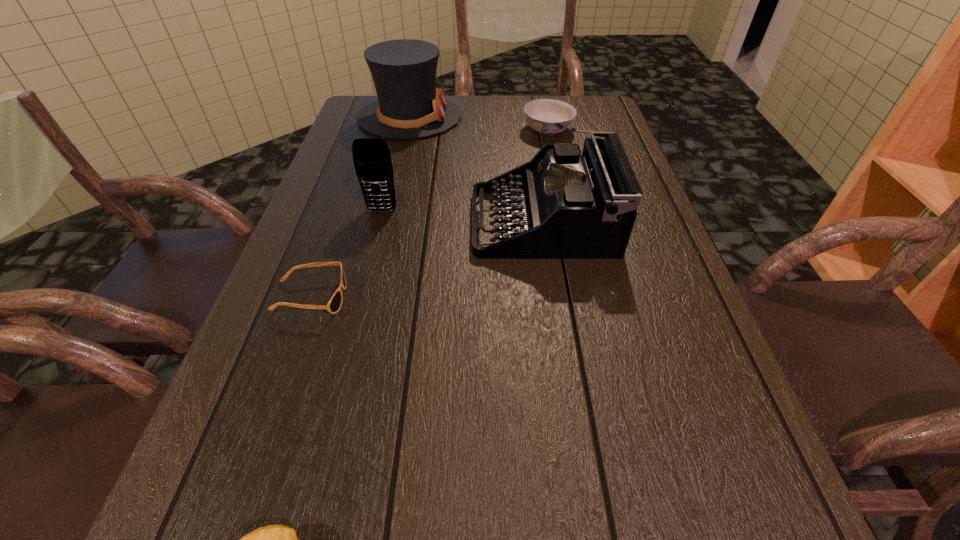
Locate an element on the screen. The height and width of the screenshot is (540, 960). object located in the far left corner section of the desktop is located at coordinates (409, 106).

Image resolution: width=960 pixels, height=540 pixels. Find the location of `object that is at the far right corner`. object that is at the far right corner is located at coordinates (548, 117).

Locate an element on the screen. The width and height of the screenshot is (960, 540). free point at the far edge is located at coordinates 522,117.

Locate an element on the screen. The width and height of the screenshot is (960, 540). blank space at the left edge is located at coordinates (358, 242).

Locate an element on the screen. This screenshot has width=960, height=540. vacant space at the far right corner of the desktop is located at coordinates (580, 124).

Image resolution: width=960 pixels, height=540 pixels. What are the coordinates of `free space between the cellular telephone and the dress hat` in the screenshot? It's located at (396, 164).

I want to click on vacant area that lies between the fifth farthest object and the dress hat, so click(360, 207).

Find the location of a particular element. free space between the cellular telephone and the dress hat is located at coordinates (396, 164).

At what (x,y) coordinates should I click in order to perform the action: click on vacant space that's between the typewriter and the dress hat. Please return your answer as a coordinate pair (x, y). This screenshot has width=960, height=540. Looking at the image, I should click on (476, 169).

This screenshot has height=540, width=960. In order to click on free spot between the typewriter and the fifth farthest object in this screenshot , I will do `click(426, 259)`.